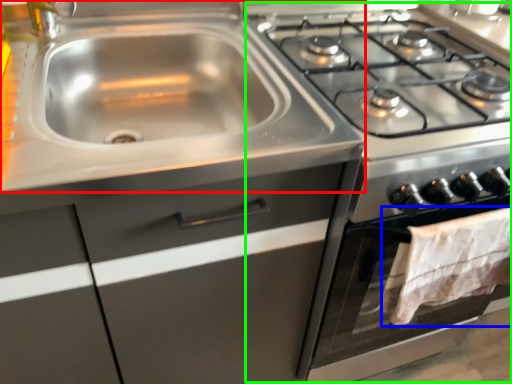
Question: Estimate the real-world distances between objects in this image. Which object is farther from sink (highlighted by a red box), blanket (highlighted by a blue box) or appliance (highlighted by a green box)?

Choices:
 (A) blanket
 (B) appliance

Answer: (A)